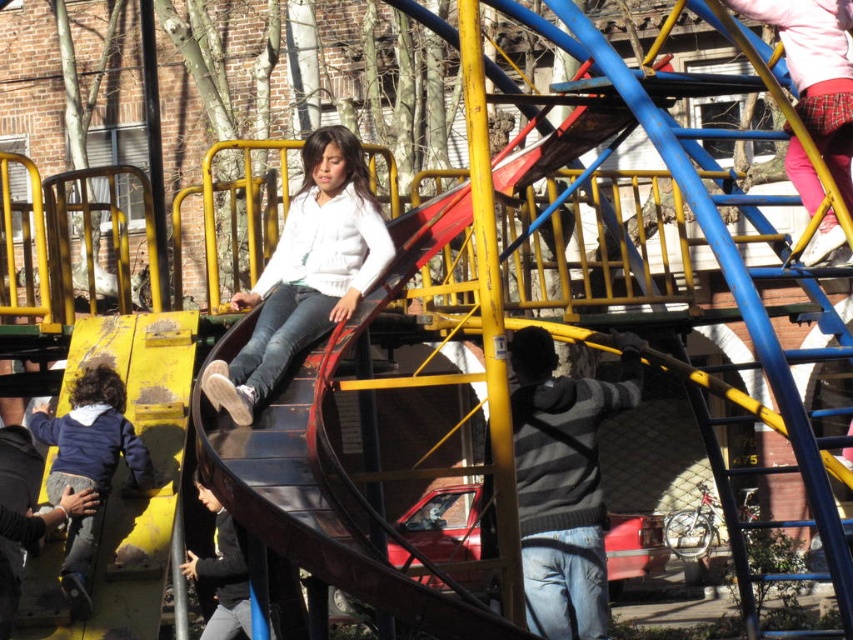
Question: Is dark blue fleece jacket at lower left smaller than dark gray sweater at center?

Choices:
 (A) yes
 (B) no

Answer: (B)

Question: Which of these objects is positioned closest to the dark gray sweater at center?

Choices:
 (A) dark blue fleece jacket at lower left
 (B) white matte sweater at center

Answer: (B)

Question: Which of these objects is positioned closest to the dark blue fleece jacket at lower left?

Choices:
 (A) dark gray sweater at center
 (B) white matte sweater at center

Answer: (B)

Question: Which object is the farthest from the white matte sweater at center?

Choices:
 (A) dark gray sweater at center
 (B) dark blue fleece jacket at lower left

Answer: (A)

Question: Is white matte sweater at center wider than dark blue fleece jacket at lower left?

Choices:
 (A) yes
 (B) no

Answer: (B)

Question: In this image, where is dark blue fleece jacket at lower left located relative to dark gray sweater at center?

Choices:
 (A) right
 (B) left

Answer: (B)